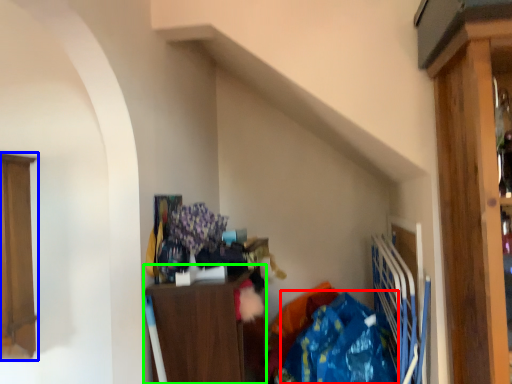
Question: Based on their relative distances, which object is farther from clothing (highlighted by a red box)? Choose from cabinetry (highlighted by a blue box) and cabinetry (highlighted by a green box).

Choices:
 (A) cabinetry
 (B) cabinetry

Answer: (A)